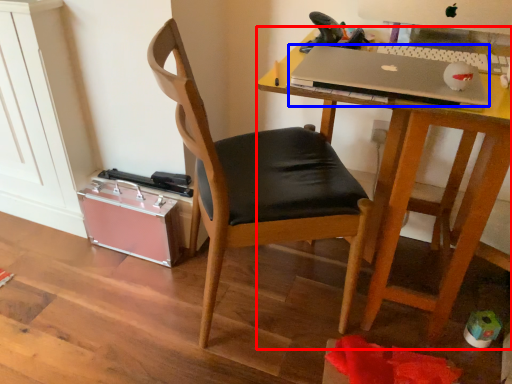
Question: Which object appears closest to the camera in this image, desk (highlighted by a red box) or laptop (highlighted by a blue box)?

Choices:
 (A) desk
 (B) laptop

Answer: (A)